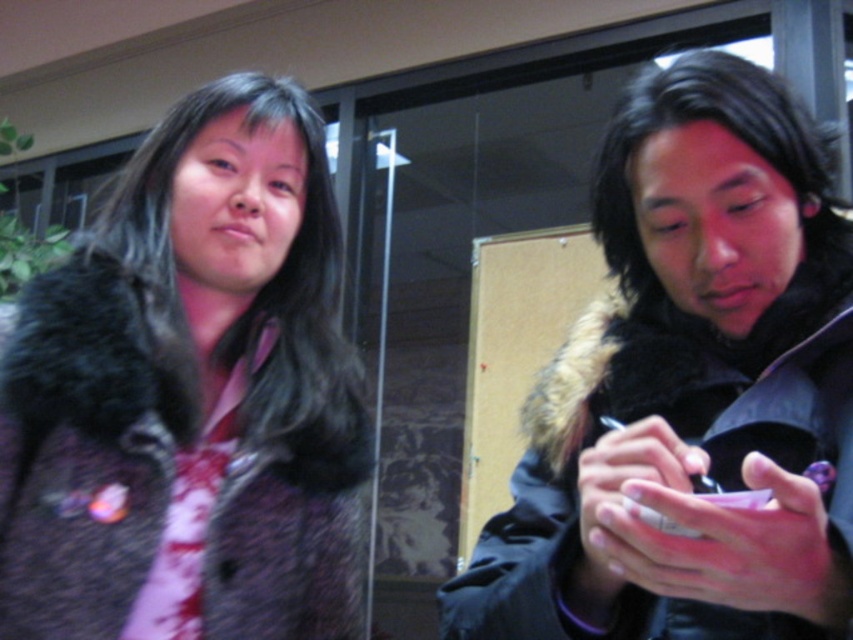
Question: Can you confirm if fuzzy fur coat at left is thinner than black fur coat at right?

Choices:
 (A) yes
 (B) no

Answer: (A)

Question: Is fuzzy fur coat at left positioned at the back of black fur coat at right?

Choices:
 (A) yes
 (B) no

Answer: (A)

Question: Is the position of fuzzy fur coat at left less distant than that of black fur coat at right?

Choices:
 (A) yes
 (B) no

Answer: (B)

Question: Which point is closer to the camera taking this photo?

Choices:
 (A) (785, 506)
 (B) (85, 314)

Answer: (A)